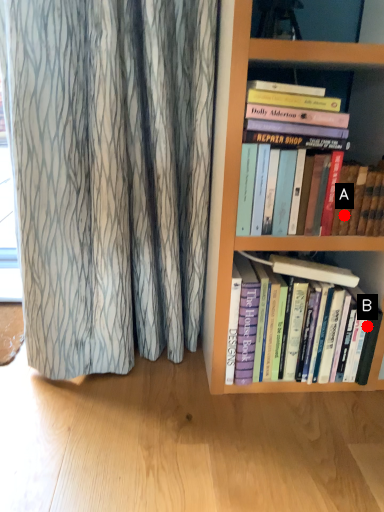
Question: Two points are circled on the image, labeled by A and B beside each circle. Which point is farther from the camera taking this photo?

Choices:
 (A) A is further
 (B) B is further

Answer: (B)